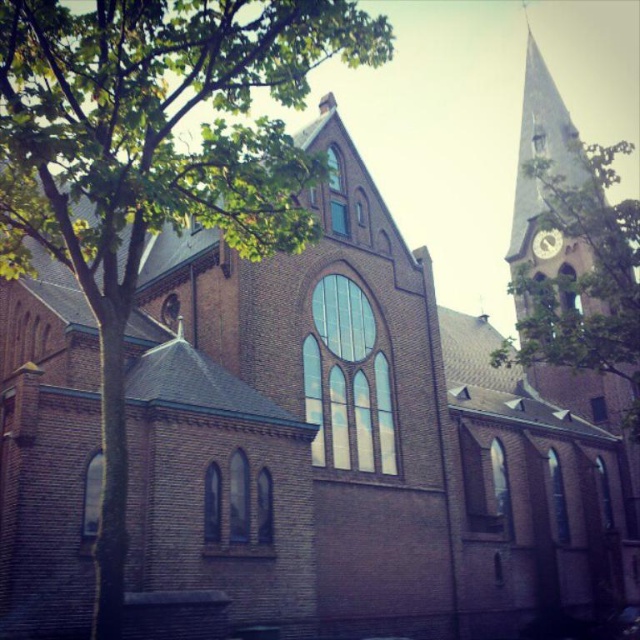
You are standing at the entrance of the traditional brick church and want to take a photo of the green leafy tree at left. In which direction relative to the church should you position yourself to capture the tree in your shot?

To capture the green leafy tree at left in your photo, position yourself to the left side of the church since the tree is located at point (154, 161) relative to the church structure.

You are standing in front of the church and want to take a photo of both the light pink stone clock tower at upper right and the metallic silver clock at upper right. Which one should you position to the left side of your camera frame to include both in the photo?

You should position the metallic silver clock at upper right to the left side of your camera frame because the light pink stone clock tower at upper right is to the right of it, ensuring both are included in the photo.

You are a visitor standing in front of the church and notice both the green leafy tree at left and the metallic silver clock at upper right. Which object appears bigger in the scene?

The green leafy tree at left appears bigger than the metallic silver clock at upper right because it has a larger size compared to it.